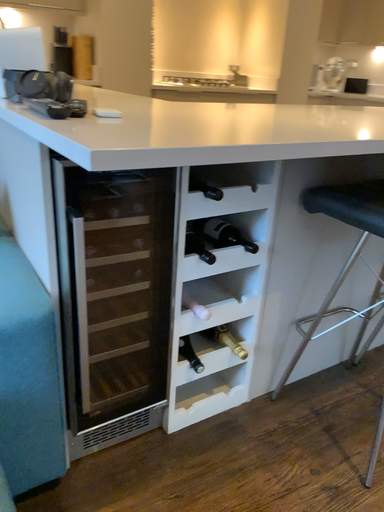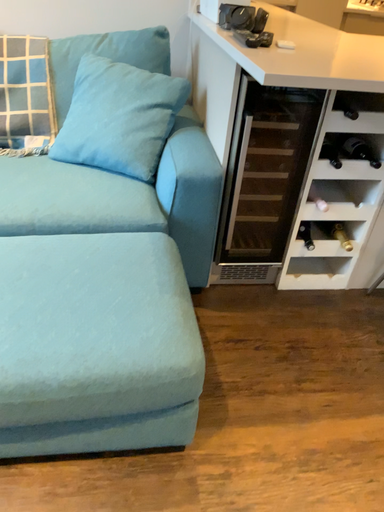
Question: How did the camera likely rotate when shooting the video?

Choices:
 (A) rotated left
 (B) rotated right

Answer: (A)